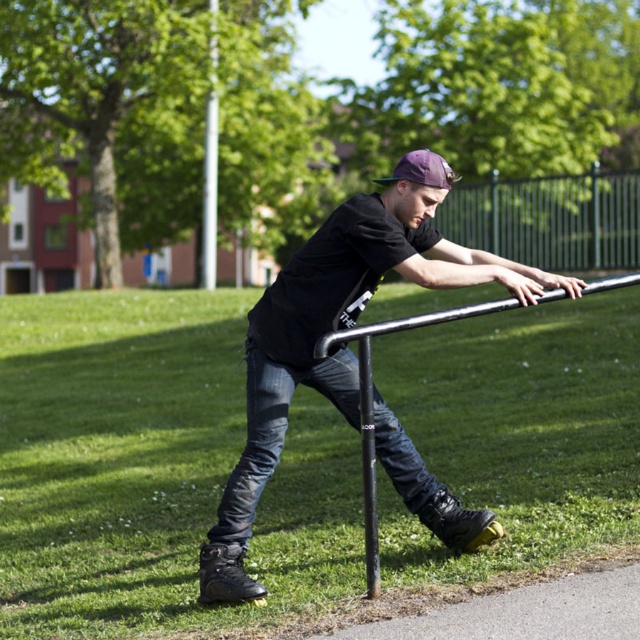
Who is higher up, black matte skateboard at center or jeans at center?

black matte skateboard at center is higher up.

Who is shorter, black matte skateboard at center or jeans at center?

Standing shorter between the two is jeans at center.

Between point (412, 460) and point (404, 445), which one is positioned in front?

Point (412, 460) is more forward.

Find the location of a particular element. The width and height of the screenshot is (640, 640). black matte skateboard at center is located at coordinates (339, 328).

Which is more to the right, black matte skateboard at center or polished metal pole at center?

From the viewer's perspective, black matte skateboard at center appears more on the right side.

The height and width of the screenshot is (640, 640). I want to click on black matte skateboard at center, so click(339, 328).

The width and height of the screenshot is (640, 640). What are the coordinates of `black matte skateboard at center` in the screenshot? It's located at (339, 328).

Does black matte skateboard at center have a larger size compared to metallic fence at upper right?

No, black matte skateboard at center is not bigger than metallic fence at upper right.

Is black matte skateboard at center wider than metallic fence at upper right?

No.

Where is `black matte skateboard at center`? Image resolution: width=640 pixels, height=640 pixels. black matte skateboard at center is located at coordinates (339, 328).